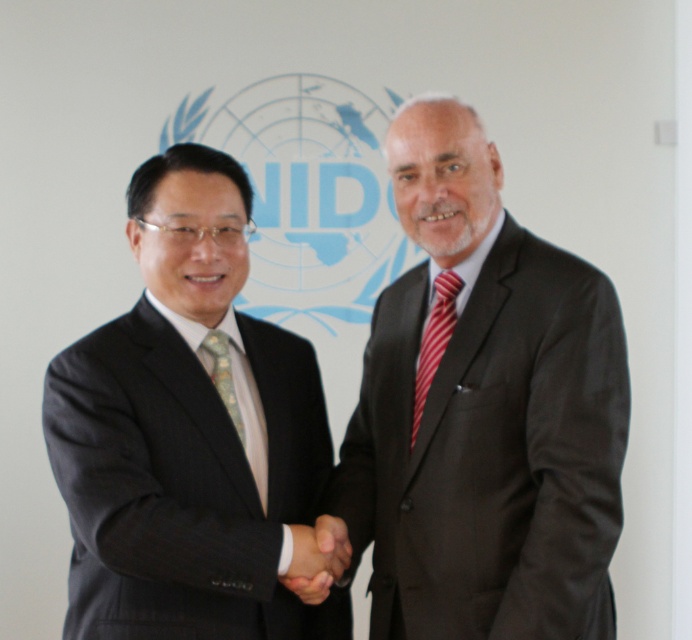
Between black suit at center and red striped tie at center, which one is positioned higher?

red striped tie at center is above.

Does black suit at center have a smaller size compared to red striped tie at center?

Incorrect, black suit at center is not smaller in size than red striped tie at center.

Measure the distance between point (426,346) and camera.

The distance of point (426,346) from camera is 5.64 feet.

Where is `black suit at center`? This screenshot has height=640, width=692. black suit at center is located at coordinates (482, 412).

Between point (280, 618) and point (210, 342), which one is positioned in front?

Point (280, 618) is in front.

Is point (134, 490) positioned after point (230, 392)?

No, (134, 490) is in front of (230, 392).

Which is in front, point (228, 582) or point (217, 342)?

Positioned in front is point (228, 582).

At what (x,y) coordinates should I click in order to perform the action: click on black textured suit at left. Please return your answer as a coordinate pair (x, y). The image size is (692, 640). Looking at the image, I should click on (188, 433).

Between red striped tie at center and green textured tie at center, which one appears on the right side from the viewer's perspective?

Positioned to the right is red striped tie at center.

Locate an element on the screen. red striped tie at center is located at coordinates (435, 339).